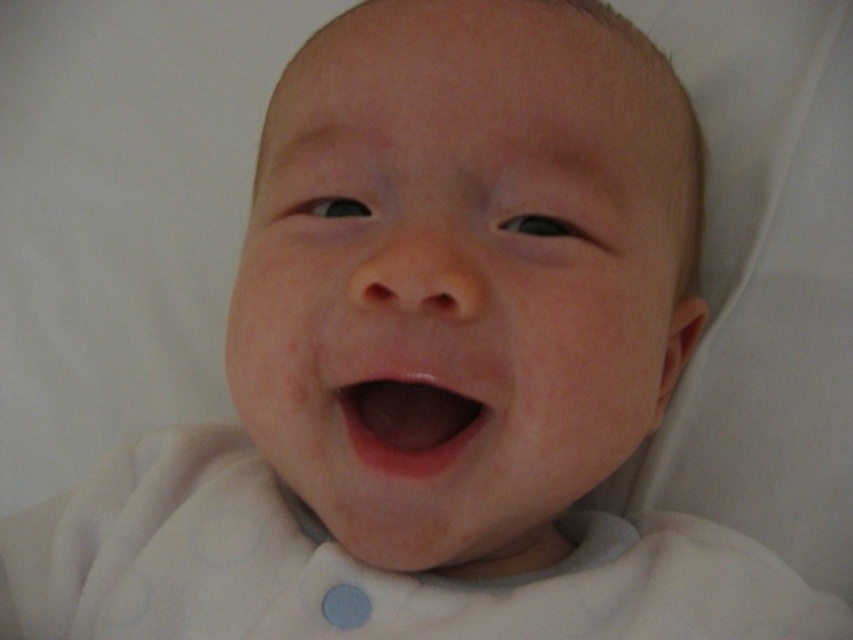
Question: Among these points, which one is nearest to the camera?

Choices:
 (A) (469, 406)
 (B) (286, 124)

Answer: (A)

Question: Can you confirm if smooth skin baby at center is positioned to the left of pink smooth flesh at center?

Choices:
 (A) yes
 (B) no

Answer: (B)

Question: Is smooth skin baby at center to the left of pink smooth flesh at center from the viewer's perspective?

Choices:
 (A) no
 (B) yes

Answer: (A)

Question: Among these objects, which one is nearest to the camera?

Choices:
 (A) smooth skin baby at center
 (B) pink smooth flesh at center

Answer: (A)

Question: Which point is closer to the camera?

Choices:
 (A) smooth skin baby at center
 (B) pink smooth flesh at center

Answer: (A)

Question: Does smooth skin baby at center appear on the right side of pink smooth flesh at center?

Choices:
 (A) yes
 (B) no

Answer: (A)